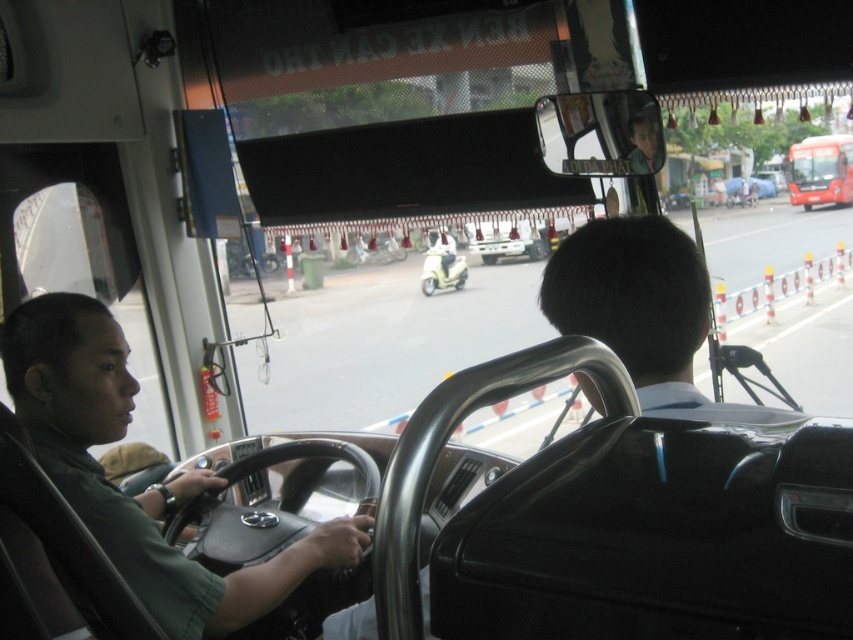
You are a passenger on the bus and want to take a photo of the green matte shirt at left and the red glossy bus at upper right through the window. Which object should you point your camera towards first to capture both in the same frame?

The green matte shirt at left is positioned on the left side of red glossy bus at upper right, so you should point your camera towards the green matte shirt at left first to ensure both objects are included in the frame.

You are standing at the point with coordinates point [119,502] inside the bus. You want to take a photo of the driver wearing a green shirt using a camera that has a 5 feet focal length. Can you take the photo without moving the camera?

The distance between point [119,502] and the camera is 4.30 feet, which is less than the camera focal length of 5 feet. Therefore, you can take the photo without moving the camera.

You are a passenger in the bus and want to know where the driver is sitting. Based on the image, where is the green matte shirt at left located?

The green matte shirt at left is located at point 0.759 on the x axis and 0.176 on the y axis.